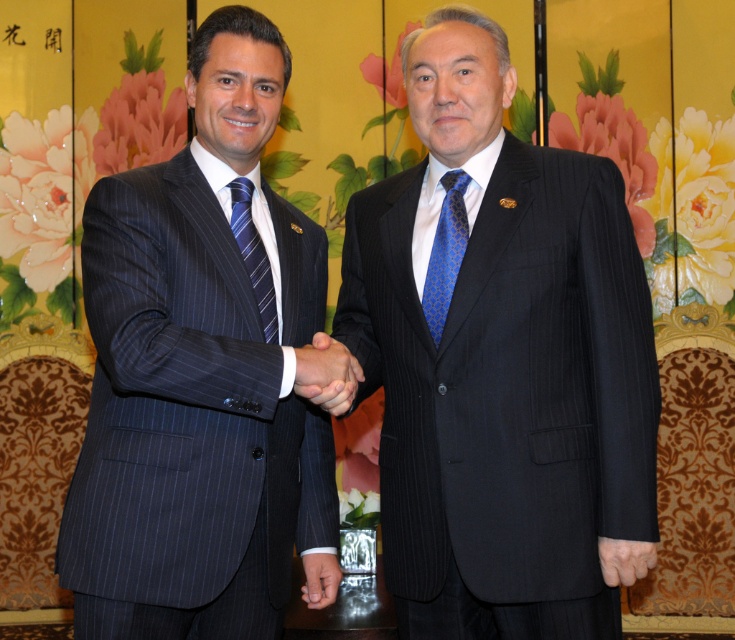
Question: Which of these objects is positioned farthest from the blue striped tie at left?

Choices:
 (A) blue silk tie at center
 (B) dark blue pinstripe suit at center
 (C) smooth skin handshake at center
 (D) blue pinstripe suit at left

Answer: (B)

Question: Is smooth skin handshake at center above blue striped tie at left?

Choices:
 (A) yes
 (B) no

Answer: (B)

Question: Is blue pinstripe suit at left above smooth skin handshake at center?

Choices:
 (A) no
 (B) yes

Answer: (B)

Question: Is dark blue pinstripe suit at center below blue pinstripe suit at left?

Choices:
 (A) no
 (B) yes

Answer: (A)

Question: Which is nearer to the smooth skin handshake at center?

Choices:
 (A) dark blue pinstripe suit at center
 (B) blue striped tie at left
 (C) blue silk tie at center

Answer: (B)

Question: Estimate the real-world distances between objects in this image. Which object is closer to the dark blue pinstripe suit at center?

Choices:
 (A) blue pinstripe suit at left
 (B) smooth skin handshake at center

Answer: (B)